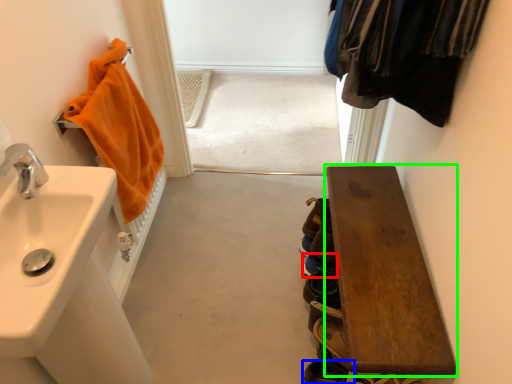
Question: Which object is the closest to the shoe (highlighted by a red box)? Choose among these: shoe (highlighted by a blue box) or furniture (highlighted by a green box).

Choices:
 (A) shoe
 (B) furniture

Answer: (B)